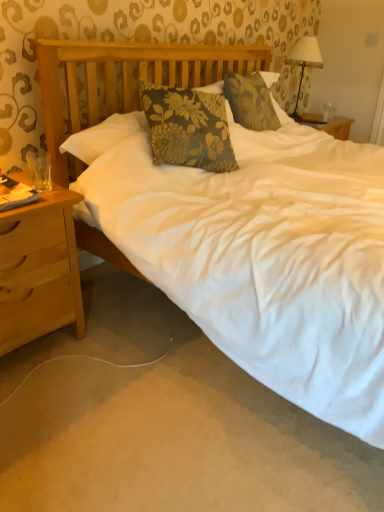
Question: From a real-world perspective, is transparent glass at upper right positioned under white fabric lampshade at upper right based on gravity?

Choices:
 (A) no
 (B) yes

Answer: (B)

Question: Does transparent glass at upper right have a greater height compared to white fabric lampshade at upper right?

Choices:
 (A) yes
 (B) no

Answer: (B)

Question: Does transparent glass at upper right have a larger size compared to white fabric lampshade at upper right?

Choices:
 (A) yes
 (B) no

Answer: (B)

Question: Is transparent glass at upper right thinner than white fabric lampshade at upper right?

Choices:
 (A) yes
 (B) no

Answer: (A)

Question: Is transparent glass at upper right with white fabric lampshade at upper right?

Choices:
 (A) no
 (B) yes

Answer: (A)

Question: From a real-world perspective, is transparent glass at upper right on top of white fabric lampshade at upper right?

Choices:
 (A) no
 (B) yes

Answer: (A)

Question: Would you say white fabric lampshade at upper right is outside light brown wood nightstand at left?

Choices:
 (A) yes
 (B) no

Answer: (A)

Question: Is white fabric lampshade at upper right taller than light brown wood nightstand at left?

Choices:
 (A) yes
 (B) no

Answer: (B)

Question: Does white fabric lampshade at upper right have a greater width compared to light brown wood nightstand at left?

Choices:
 (A) no
 (B) yes

Answer: (A)

Question: Can you confirm if white fabric lampshade at upper right is positioned to the left of light brown wood nightstand at left?

Choices:
 (A) yes
 (B) no

Answer: (B)

Question: Does white fabric lampshade at upper right turn towards light brown wood nightstand at left?

Choices:
 (A) yes
 (B) no

Answer: (B)

Question: Considering the relative sizes of white fabric lampshade at upper right and light brown wood nightstand at left in the image provided, is white fabric lampshade at upper right smaller than light brown wood nightstand at left?

Choices:
 (A) no
 (B) yes

Answer: (B)

Question: Is white fabric lampshade at upper right to the left of transparent glass at upper right from the viewer's perspective?

Choices:
 (A) yes
 (B) no

Answer: (A)